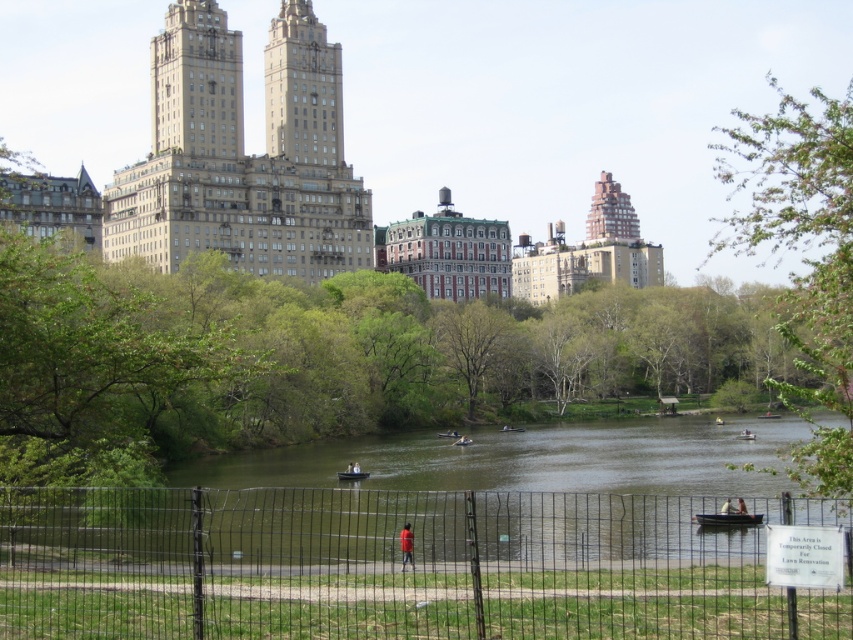
Question: In this image, where is green leafy tree at right located relative to white plastic boat at center?

Choices:
 (A) left
 (B) right

Answer: (B)

Question: Can you confirm if black wire fence at lower center is smaller than wooden canoe at center?

Choices:
 (A) no
 (B) yes

Answer: (A)

Question: Which point is farther to the camera?

Choices:
 (A) wooden rowboat at center
 (B) green leafy tree at right

Answer: (A)

Question: Which point is closer to the camera?

Choices:
 (A) (469, 417)
 (B) (177, 467)
 (C) (715, 516)
 (D) (339, 472)

Answer: (C)

Question: In this image, where is green leafy tree at center located relative to wooden boat at lower center?

Choices:
 (A) left
 (B) right

Answer: (A)

Question: Which point is farther from the camera taking this photo?

Choices:
 (A) (730, 522)
 (B) (283, 476)
 (C) (831, 205)
 (D) (747, 438)

Answer: (D)